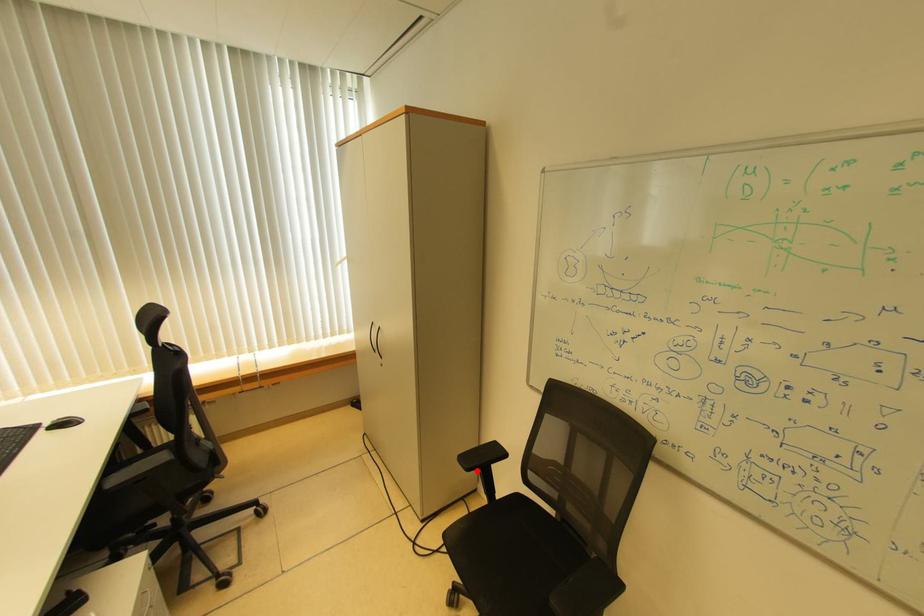
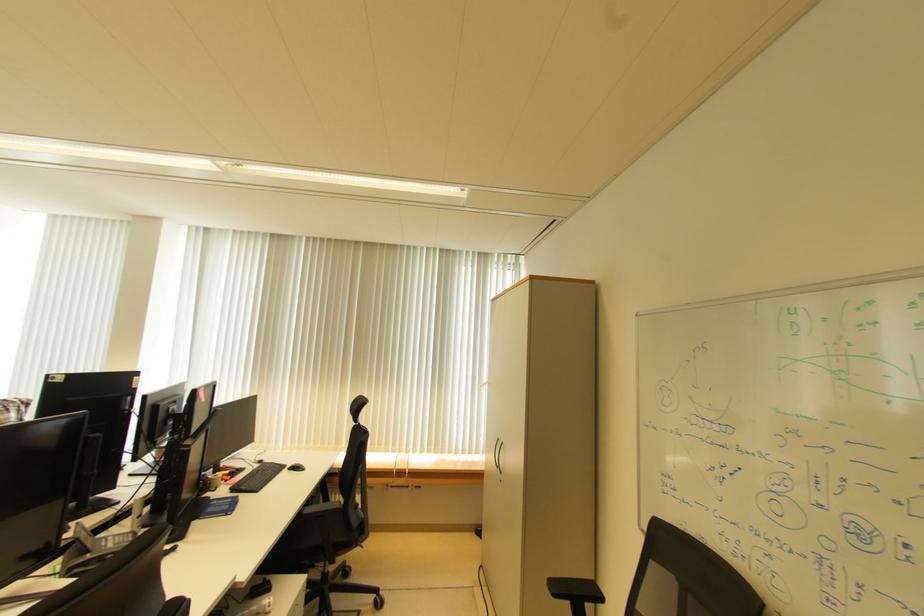
Question: I am providing you with two images of the same scene from different viewpoints. Given a red point in image1, look at the same physical point in image2. Is it:

Choices:
 (A) Closer to the viewpoint
 (B) Farther from the viewpoint

Answer: (B)